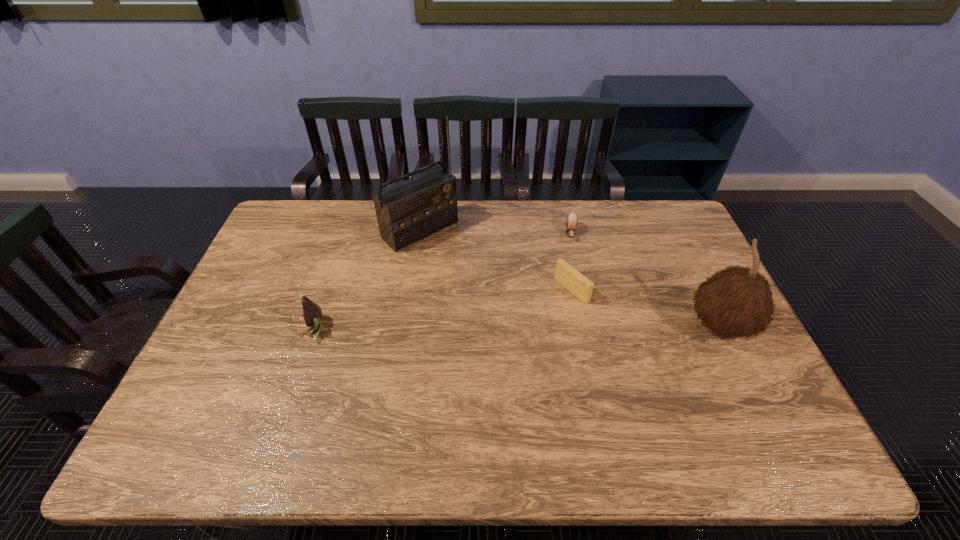
Find the location of `escargot that is at the far edge`. escargot that is at the far edge is located at coordinates (571, 221).

The width and height of the screenshot is (960, 540). What are the coordinates of `radio receiver at the far edge` in the screenshot? It's located at (410, 210).

Locate an element on the screen. object at the right edge is located at coordinates (737, 301).

The width and height of the screenshot is (960, 540). Identify the location of free space at the far edge. (x=461, y=232).

Locate an element on the screen. vacant space at the near edge is located at coordinates 323,410.

Find the location of a particular element. Image resolution: width=960 pixels, height=540 pixels. free space at the left edge of the desktop is located at coordinates (241, 291).

The image size is (960, 540). I want to click on free space at the right edge, so click(694, 343).

Find the location of a particular element. free space at the far right corner of the desktop is located at coordinates (662, 234).

Find the location of a particular element. The height and width of the screenshot is (540, 960). vacant space at the near right corner of the desktop is located at coordinates (726, 389).

I want to click on free space between the videotape and the second tallest object, so click(x=646, y=308).